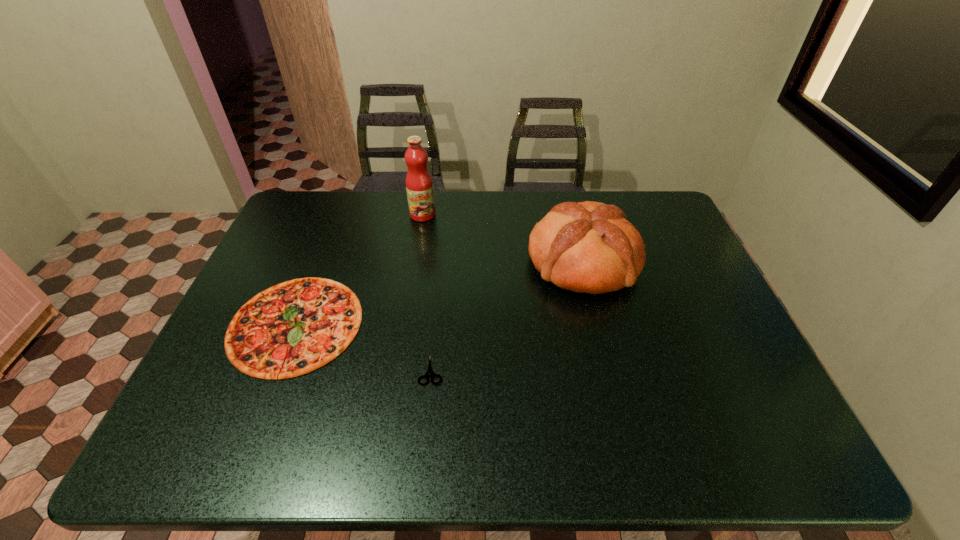
Image resolution: width=960 pixels, height=540 pixels. In order to click on vacant area at the far right corner in this screenshot , I will do [x=650, y=195].

Locate an element on the screen. empty space between the second tallest object and the pizza is located at coordinates (440, 293).

Find the location of a particular element. Image resolution: width=960 pixels, height=540 pixels. free spot between the second shortest object and the second object from right to left is located at coordinates (363, 347).

Locate an element on the screen. The image size is (960, 540). free space between the pizza and the tallest object is located at coordinates (359, 269).

Find the location of a particular element. This screenshot has width=960, height=540. vacant area between the leftmost object and the tallest object is located at coordinates (359, 269).

Locate an element on the screen. empty space between the second object from left to right and the leftmost object is located at coordinates (359, 269).

Identify the location of vacant area that lies between the shortest object and the farthest object. (427, 293).

Where is `vacant area that lies between the pizza and the rightmost object`? The height and width of the screenshot is (540, 960). vacant area that lies between the pizza and the rightmost object is located at coordinates (440, 293).

You are a GUI agent. You are given a task and a screenshot of the screen. Output one action in this format:
    pyautogui.click(x=<x>, y=<y>)
    Task: Click on the vacant point located between the second object from right to left and the bread
    
    Given the screenshot: What is the action you would take?
    pyautogui.click(x=507, y=316)

Locate an element on the screen. The image size is (960, 540). unoccupied position between the shears and the farthest object is located at coordinates (427, 293).